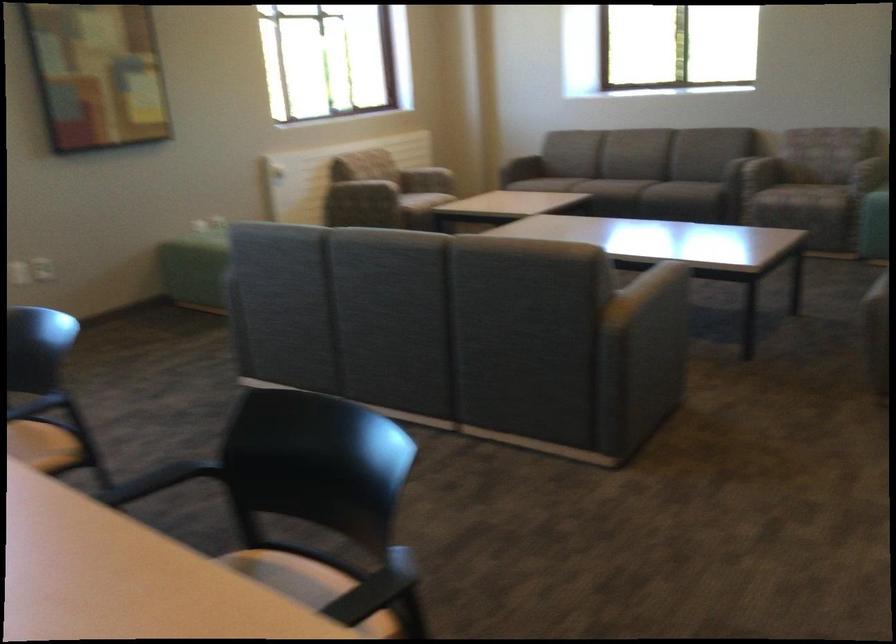
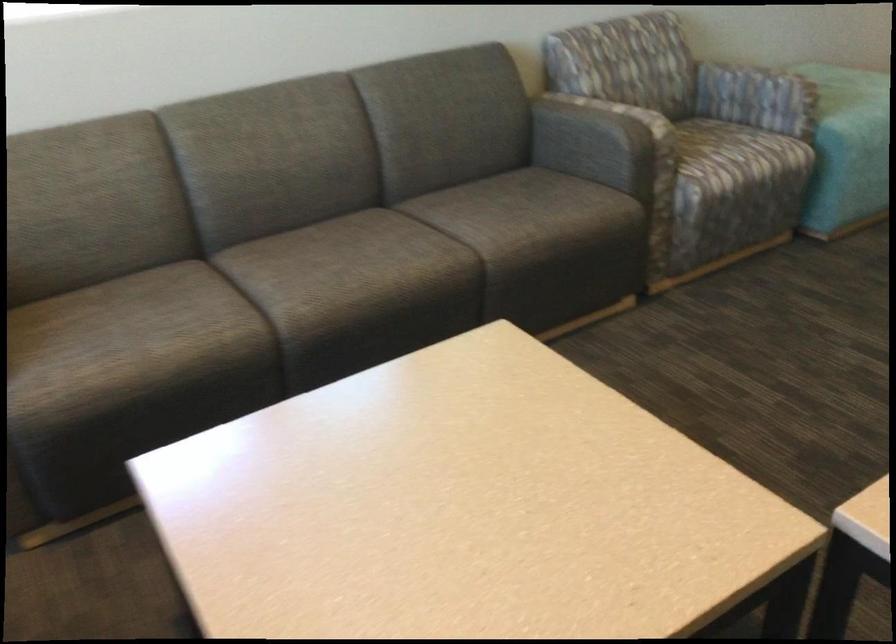
Where in the second image is the point corresponding to point 607,180 from the first image?

(427, 269)